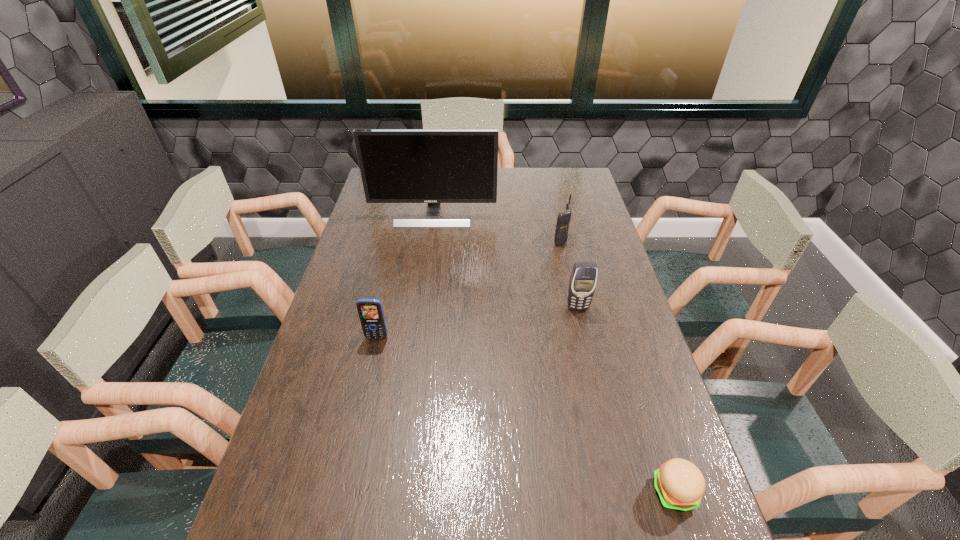
The height and width of the screenshot is (540, 960). I want to click on vacant area at the right edge, so click(x=604, y=237).

The height and width of the screenshot is (540, 960). Identify the location of free space between the farthest object and the third farthest object. (506, 261).

Where is `unoccupied area between the farthest cellular telephone and the nearest object`? unoccupied area between the farthest cellular telephone and the nearest object is located at coordinates (617, 366).

This screenshot has height=540, width=960. What are the coordinates of `vacant area that lies between the nearest object and the monitor` in the screenshot? It's located at (554, 354).

Find the location of a particular element. The image size is (960, 540). empty space that is in between the third farthest object and the nearest cellular telephone is located at coordinates (477, 322).

The width and height of the screenshot is (960, 540). I want to click on vacant space in between the nearest object and the monitor, so click(554, 354).

Image resolution: width=960 pixels, height=540 pixels. Find the location of `blank region between the leftmost cellular telephone and the farthest object`. blank region between the leftmost cellular telephone and the farthest object is located at coordinates (405, 276).

Locate an element on the screen. free space that is in between the tallest object and the second nearest object is located at coordinates (405, 276).

This screenshot has width=960, height=540. I want to click on vacant point located between the second nearest cellular telephone and the shortest object, so click(x=626, y=400).

You are a GUI agent. You are given a task and a screenshot of the screen. Output one action in this format:
    pyautogui.click(x=<x>, y=<y>)
    Task: Click on the free spot between the third farthest object and the nearest cellular telephone
    The width and height of the screenshot is (960, 540).
    Given the screenshot: What is the action you would take?
    pyautogui.click(x=477, y=322)